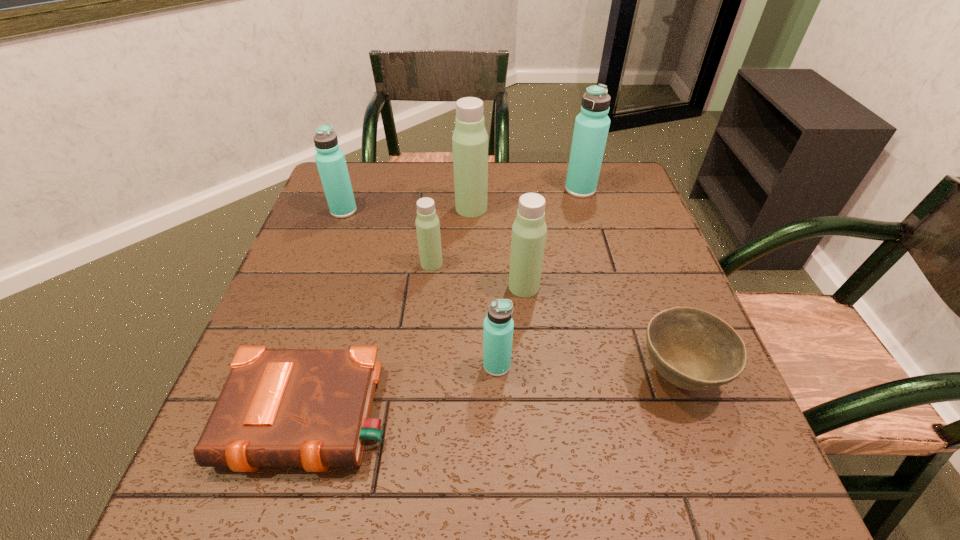
This screenshot has height=540, width=960. I want to click on blank space located on the left of the seventh tallest object, so click(x=519, y=375).

At what (x,y) coordinates should I click in order to perform the action: click on object present at the near edge. Please return your answer as a coordinate pair (x, y). Looking at the image, I should click on (310, 408).

This screenshot has width=960, height=540. Identify the location of thermos bottle at the left edge. (330, 159).

This screenshot has width=960, height=540. Find the location of `Bible at the left edge`. Bible at the left edge is located at coordinates [x=310, y=408].

Identify the location of thermos bottle at the right edge. The image size is (960, 540). (591, 128).

This screenshot has width=960, height=540. Find the location of `bowl present at the right edge`. bowl present at the right edge is located at coordinates (695, 350).

This screenshot has height=540, width=960. Identify the location of object situated at the far left corner. (330, 159).

This screenshot has width=960, height=540. In order to click on object positioned at the near left corner in this screenshot , I will do `click(310, 408)`.

This screenshot has width=960, height=540. I want to click on object that is positioned at the far right corner, so pos(591,128).

Locate an element on the screen. The height and width of the screenshot is (540, 960). free space at the far edge is located at coordinates (446, 198).